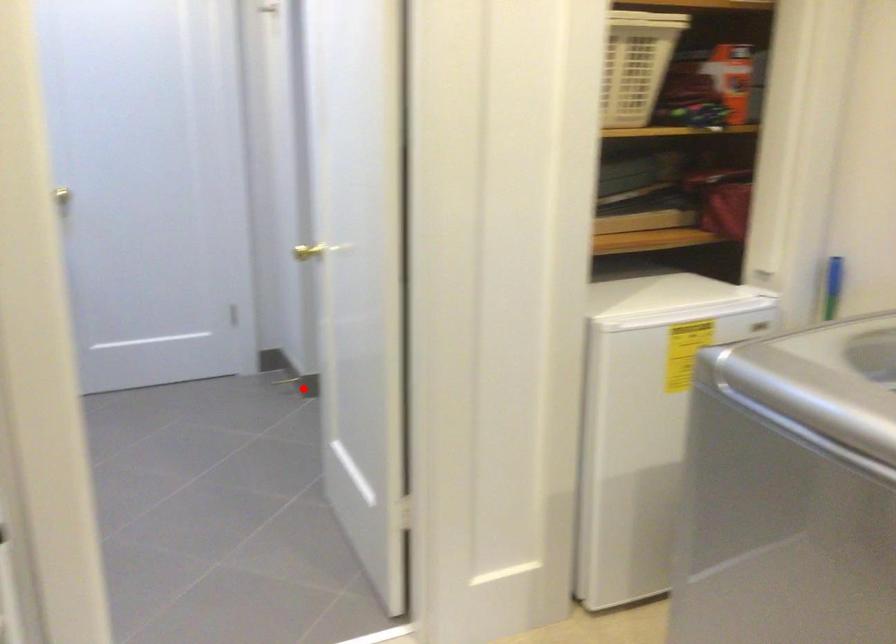
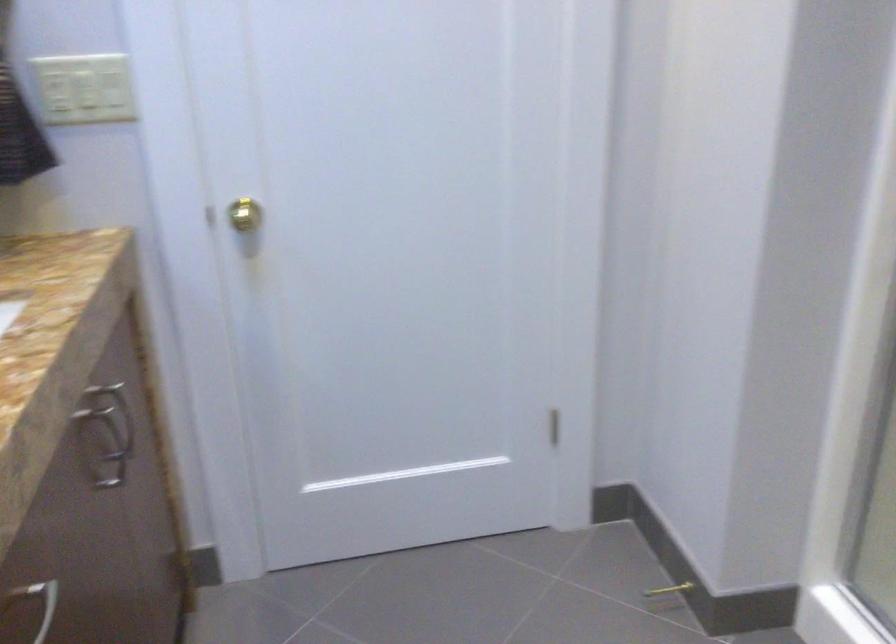
Find the pixel in the second image that matches the highlighted location in the first image.

(666, 596)